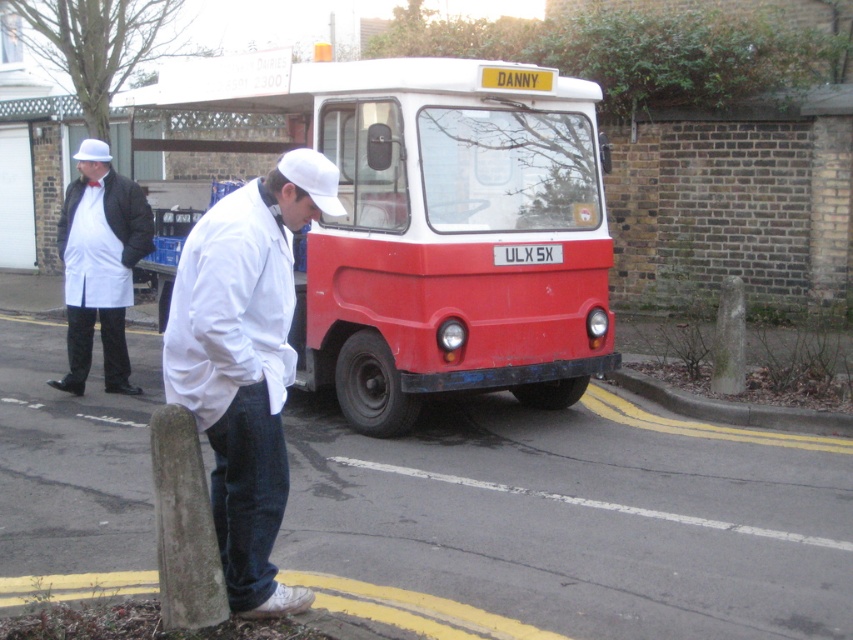
You are a delivery person trying to load a tall box onto the red matte food truck at center. The box is as tall as the white matte shirt at center. Will the box fit vertically on the truck without bending?

The red matte food truck at center is taller than the white matte shirt at center, so the box, which is as tall as the white matte shirt at center, will fit vertically on the truck without bending.

Looking at this image, you are a delivery driver who needs to park your van at the curb. There is a red matte food truck at center marked by point (434,225). Can you safely park your van next to it without blocking the sidewalk?

The point (434,225) marks the red matte food truck at center, so parking next to it may block the sidewalk unless there is sufficient space. However, the scene does not provide specific measurements about available parking space or sidewalk width. Therefore, it is uncertain if parking next to the red matte food truck at center is safe and nonobstructive.